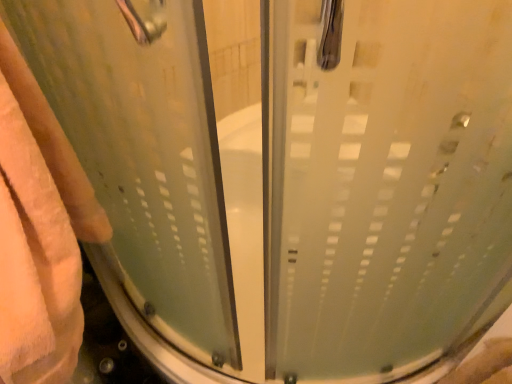
Measure the distance between point (343, 352) and camera.

They are 29.69 inches apart.

You are a GUI agent. You are given a task and a screenshot of the screen. Output one action in this format:
    pyautogui.click(x=<x>, y=<y>)
    Task: Click on the frosted glass shower door at center, the 2th screen door when ordered from left to right
    Image resolution: width=512 pixels, height=384 pixels.
    Given the screenshot: What is the action you would take?
    pyautogui.click(x=383, y=184)

Starting from the beige fluffy towel at left, which screen door is the 1st one in front? Please provide its 2D coordinates.

[(383, 184)]

Which of these two, frosted glass shower door at center, placed as the 1th screen door when sorted from right to left, or beige fluffy towel at left, stands taller?

beige fluffy towel at left.

Is point (279, 4) closer or farther from the camera than point (3, 158)?

Point (279, 4) is positioned closer to the camera compared to point (3, 158).

From a real-world perspective, is frosted glass shower door at center, placed as the 1th screen door when sorted from right to left, located higher than beige fluffy towel at left?

Yes.

Which point is more distant from viewer, (334, 165) or (133, 297)?

The point (133, 297) is farther.

Can frosted glass shower door at center, the 1th screen door in the left-to-right sequence, be found inside frosted glass shower door at center, the 2th screen door when ordered from left to right?

Definitely not — frosted glass shower door at center, the 1th screen door in the left-to-right sequence, is not inside frosted glass shower door at center, the 2th screen door when ordered from left to right.

Can you tell me how much frosted glass shower door at center, placed as the 1th screen door when sorted from right to left, and frosted glass shower door at center, placed as the 2th screen door when sorted from right to left, differ in facing direction?

90 degrees.

Locate an element on the screen. This screenshot has height=384, width=512. screen door located above the frosted glass shower door at center, placed as the 1th screen door when sorted from right to left (from the image's perspective) is located at coordinates (144, 153).

Considering the positions of objects frosted glass shower door at center, the 1th screen door in the left-to-right sequence, and frosted glass shower door at center, placed as the 1th screen door when sorted from right to left, in the image provided, who is in front, frosted glass shower door at center, the 1th screen door in the left-to-right sequence, or frosted glass shower door at center, placed as the 1th screen door when sorted from right to left,?

frosted glass shower door at center, the 1th screen door in the left-to-right sequence.

Is frosted glass shower door at center, the 1th screen door in the left-to-right sequence, oriented towards frosted glass shower door at center, the 2th screen door when ordered from left to right?

No.

From the image's perspective, which object appears higher, frosted glass shower door at center, the 1th screen door in the left-to-right sequence, or frosted glass shower door at center, the 2th screen door when ordered from left to right?

From the image's view, frosted glass shower door at center, the 1th screen door in the left-to-right sequence, is above.

Is frosted glass shower door at center, the 1th screen door in the left-to-right sequence, completely or partially inside beige fluffy towel at left?

Definitely not — frosted glass shower door at center, the 1th screen door in the left-to-right sequence, is not inside beige fluffy towel at left.

Is beige fluffy towel at left positioned in front of frosted glass shower door at center, the 1th screen door in the left-to-right sequence?

No, beige fluffy towel at left is further to the viewer.

From the image's perspective, is beige fluffy towel at left above or below frosted glass shower door at center, placed as the 2th screen door when sorted from right to left?

beige fluffy towel at left is below frosted glass shower door at center, placed as the 2th screen door when sorted from right to left.

From the picture: Can you confirm if beige fluffy towel at left is bigger than frosted glass shower door at center, placed as the 2th screen door when sorted from right to left?

Indeed, beige fluffy towel at left has a larger size compared to frosted glass shower door at center, placed as the 2th screen door when sorted from right to left.

Does point (35, 247) lie in front of point (370, 364)?

That is True.

In the image, is beige fluffy towel at left on the left side or the right side of frosted glass shower door at center, the 2th screen door when ordered from left to right?

Clearly, beige fluffy towel at left is on the left of frosted glass shower door at center, the 2th screen door when ordered from left to right, in the image.

Is beige fluffy towel at left oriented towards frosted glass shower door at center, the 2th screen door when ordered from left to right?

No, beige fluffy towel at left is not aimed at frosted glass shower door at center, the 2th screen door when ordered from left to right.

Could frosted glass shower door at center, placed as the 1th screen door when sorted from right to left, be considered to be inside beige fluffy towel at left?

No, frosted glass shower door at center, placed as the 1th screen door when sorted from right to left, is not inside beige fluffy towel at left.

Based on the photo, does frosted glass shower door at center, the 1th screen door in the left-to-right sequence, turn towards beige fluffy towel at left?

Yes, frosted glass shower door at center, the 1th screen door in the left-to-right sequence, is aimed at beige fluffy towel at left.

Is frosted glass shower door at center, placed as the 2th screen door when sorted from right to left, wider than beige fluffy towel at left?

No, frosted glass shower door at center, placed as the 2th screen door when sorted from right to left, is not wider than beige fluffy towel at left.

Considering the relative sizes of frosted glass shower door at center, placed as the 2th screen door when sorted from right to left, and beige fluffy towel at left in the image provided, is frosted glass shower door at center, placed as the 2th screen door when sorted from right to left, taller than beige fluffy towel at left?

No, frosted glass shower door at center, placed as the 2th screen door when sorted from right to left, is not taller than beige fluffy towel at left.

From a real-world perspective, starting from the beige fluffy towel at left, which screen door is the 1st one vertically above it? Please provide its 2D coordinates.

[(383, 184)]

Locate an element on the screen. This screenshot has height=384, width=512. screen door located on the right of frosted glass shower door at center, placed as the 2th screen door when sorted from right to left is located at coordinates (383, 184).

From the picture: From the image, which object appears to be farther from beige fluffy towel at left, frosted glass shower door at center, the 1th screen door in the left-to-right sequence, or frosted glass shower door at center, the 2th screen door when ordered from left to right?

Among the two, frosted glass shower door at center, the 2th screen door when ordered from left to right, is located further to beige fluffy towel at left.

Looking at the image, which one is located further to frosted glass shower door at center, placed as the 2th screen door when sorted from right to left, beige fluffy towel at left or frosted glass shower door at center, the 2th screen door when ordered from left to right?

frosted glass shower door at center, the 2th screen door when ordered from left to right, lies further to frosted glass shower door at center, placed as the 2th screen door when sorted from right to left, than the other object.

Based on the photo, when comparing their distances from frosted glass shower door at center, placed as the 1th screen door when sorted from right to left, does frosted glass shower door at center, placed as the 2th screen door when sorted from right to left, or beige fluffy towel at left seem closer?

frosted glass shower door at center, placed as the 2th screen door when sorted from right to left, is closer to frosted glass shower door at center, placed as the 1th screen door when sorted from right to left.

Consider the image. Looking at the image, which one is located closer to frosted glass shower door at center, the 1th screen door in the left-to-right sequence, frosted glass shower door at center, placed as the 1th screen door when sorted from right to left, or beige fluffy towel at left?

beige fluffy towel at left lies closer to frosted glass shower door at center, the 1th screen door in the left-to-right sequence, than the other object.

Estimate the real-world distances between objects in this image. Which object is further from beige fluffy towel at left, frosted glass shower door at center, the 2th screen door when ordered from left to right, or frosted glass shower door at center, the 1th screen door in the left-to-right sequence?

The object further to beige fluffy towel at left is frosted glass shower door at center, the 2th screen door when ordered from left to right.

Based on their spatial positions, is beige fluffy towel at left or frosted glass shower door at center, the 1th screen door in the left-to-right sequence, further from frosted glass shower door at center, placed as the 1th screen door when sorted from right to left?

The object further to frosted glass shower door at center, placed as the 1th screen door when sorted from right to left, is beige fluffy towel at left.

What are the coordinates of `screen door between beige fluffy towel at left and frosted glass shower door at center, placed as the 1th screen door when sorted from right to left, in the horizontal direction` in the screenshot? It's located at pos(144,153).